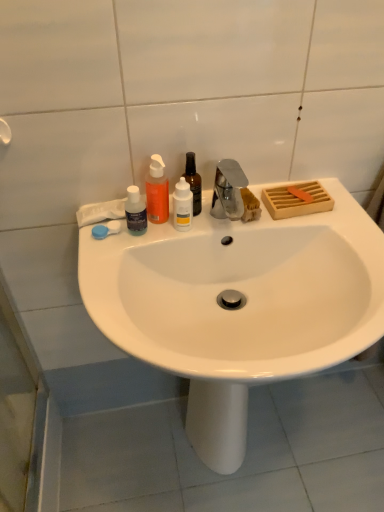
Where is `free space below white glossy sink at center (from a real-world perspective)`? The width and height of the screenshot is (384, 512). free space below white glossy sink at center (from a real-world perspective) is located at coordinates (243, 482).